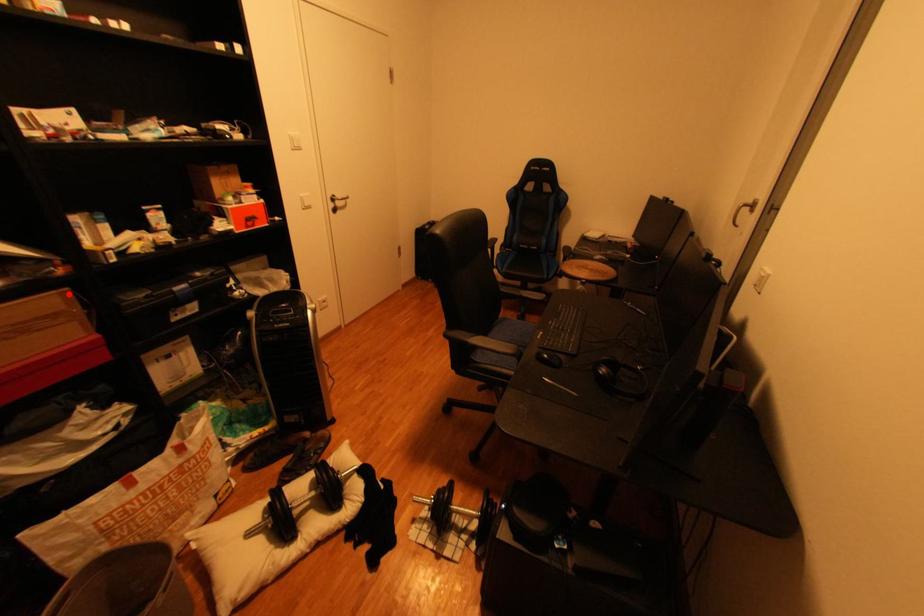
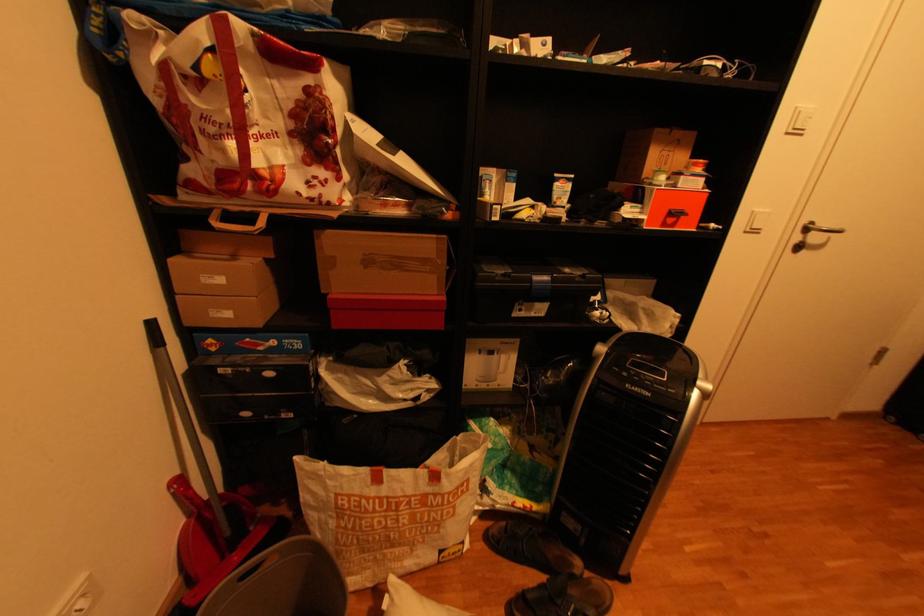
Question: I am providing you with two images of the same scene from different viewpoints. A red point is shown in image1. For the corresponding object point in image2, is it positioned nearer or farther from the camera?

Choices:
 (A) Nearer
 (B) Farther

Answer: (A)